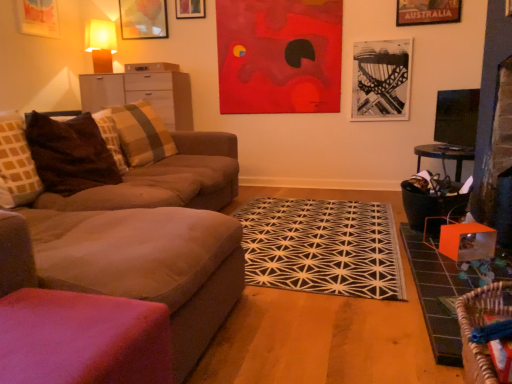
Question: Is matte orange lampshade at upper left in front of or behind black geometric rug at center in the image?

Choices:
 (A) behind
 (B) front

Answer: (A)

Question: In the image, is matte orange lampshade at upper left on the left side or the right side of black geometric rug at center?

Choices:
 (A) right
 (B) left

Answer: (B)

Question: Estimate the real-world distances between objects in this image. Which object is farther from the wooden picture frame at upper center, marked as the third picture frame in a left-to-right arrangement?

Choices:
 (A) matte white drawer at upper left
 (B) matte orange lampshade at upper left
 (C) orange cardboard box at lower right
 (D) matte glass picture frame at upper left, which is the 3th picture frame from right to left
 (E) velvet brown couch at left, which is the 1th studio couch in back-to-front order

Answer: (C)

Question: Based on their relative distances, which object is farther from the woven wood swivel chair at lower right?

Choices:
 (A) brown textured pillow at left, the 2th pillow in the back-to-front sequence
 (B) matte glass picture frame at upper left, which is the 3th picture frame from right to left
 (C) black geometric rug at center
 (D) matte wood cabinet at left
 (E) matte orange lampshade at upper left

Answer: (B)